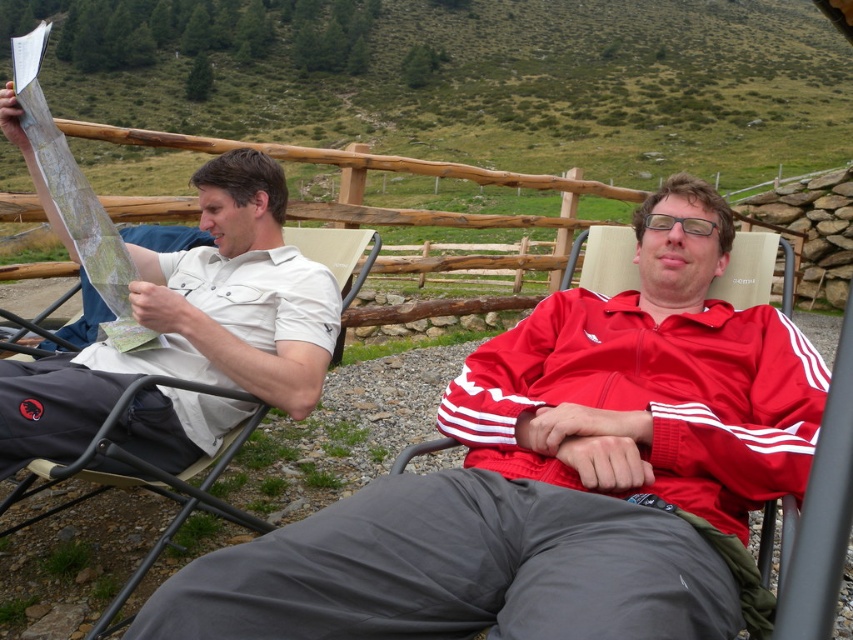
Does red synthetic jacket at center appear on the right side of beige fabric beach chair at left?

Correct, you'll find red synthetic jacket at center to the right of beige fabric beach chair at left.

Is red synthetic jacket at center positioned in front of beige fabric beach chair at left?

Yes, it is in front of beige fabric beach chair at left.

Locate an element on the screen. This screenshot has width=853, height=640. red synthetic jacket at center is located at coordinates (558, 477).

Is point (175, 324) closer to viewer compared to point (120, 600)?

No, it is behind (120, 600).

Where is `matte white shirt at left`? matte white shirt at left is located at coordinates (192, 321).

Is point (297, 538) behind point (135, 307)?

No, it is in front of (135, 307).

Between red synthetic jacket at center and matte white shirt at left, which one has more height?

Standing taller between the two is matte white shirt at left.

Is point (578, 292) in front of point (277, 332)?

Yes.

You are a GUI agent. You are given a task and a screenshot of the screen. Output one action in this format:
    pyautogui.click(x=<x>, y=<y>)
    Task: Click on the red synthetic jacket at center
    
    Given the screenshot: What is the action you would take?
    pyautogui.click(x=558, y=477)